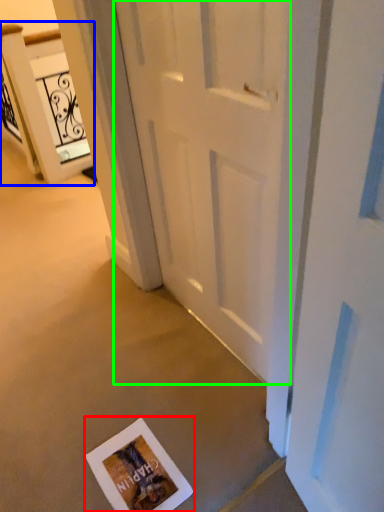
Question: Based on their relative distances, which object is farther from postcard (highlighted by a red box)? Choose from elevator (highlighted by a blue box) and door (highlighted by a green box).

Choices:
 (A) elevator
 (B) door

Answer: (A)